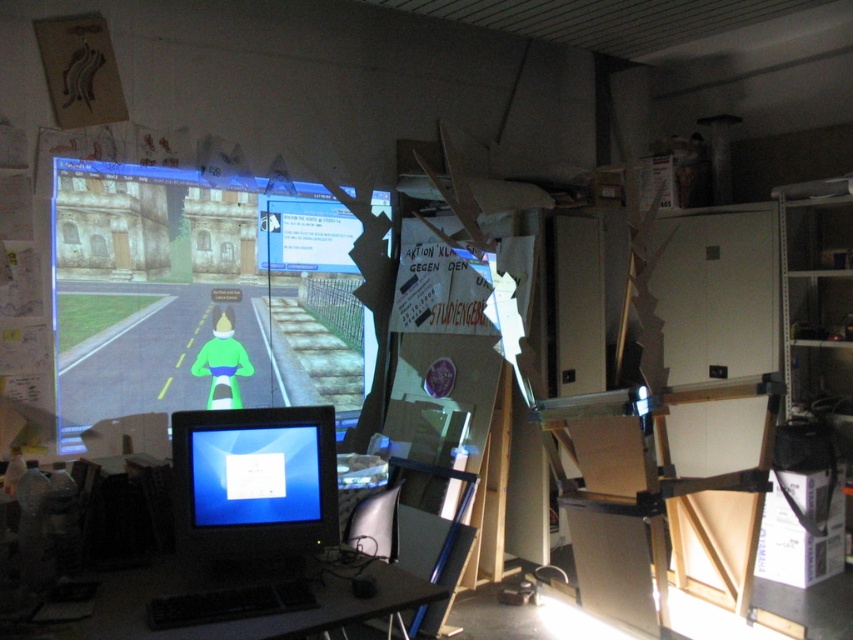
Question: Which point is closer to the camera?

Choices:
 (A) (260, 422)
 (B) (108, 608)

Answer: (B)

Question: Is matte black monitor at lower left to the left of black plastic computer desk at lower center from the viewer's perspective?

Choices:
 (A) yes
 (B) no

Answer: (A)

Question: Which point is farther from the camera taking this photo?

Choices:
 (A) (206, 628)
 (B) (318, 541)

Answer: (B)

Question: In this image, where is matte black monitor at lower left located relative to black plastic computer desk at lower center?

Choices:
 (A) left
 (B) right

Answer: (A)

Question: Does matte black monitor at lower left have a lesser width compared to black plastic computer desk at lower center?

Choices:
 (A) yes
 (B) no

Answer: (A)